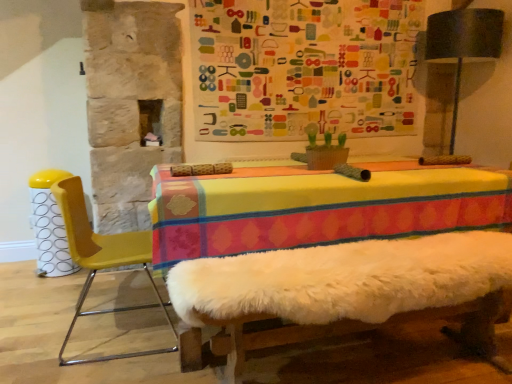
Question: Does yellow plastic chair at left have a greater height compared to yellow plastic bar stool at left?

Choices:
 (A) yes
 (B) no

Answer: (A)

Question: Is yellow plastic chair at left thinner than yellow plastic bar stool at left?

Choices:
 (A) no
 (B) yes

Answer: (A)

Question: Considering the relative sizes of yellow plastic chair at left and yellow plastic bar stool at left in the image provided, is yellow plastic chair at left smaller than yellow plastic bar stool at left?

Choices:
 (A) no
 (B) yes

Answer: (A)

Question: From a real-world perspective, is yellow plastic chair at left on yellow plastic bar stool at left?

Choices:
 (A) yes
 (B) no

Answer: (A)

Question: Is there a large distance between yellow plastic chair at left and yellow plastic bar stool at left?

Choices:
 (A) yes
 (B) no

Answer: (B)

Question: From a real-world perspective, is multicolored fabric bulletin board at upper center above or below yellow plastic bar stool at left?

Choices:
 (A) below
 (B) above

Answer: (B)

Question: Relative to yellow plastic bar stool at left, is multicolored fabric bulletin board at upper center in front or behind?

Choices:
 (A) behind
 (B) front

Answer: (A)

Question: Is multicolored fabric bulletin board at upper center inside the boundaries of yellow plastic bar stool at left, or outside?

Choices:
 (A) outside
 (B) inside

Answer: (A)

Question: Is multicolored fabric bulletin board at upper center taller or shorter than yellow plastic bar stool at left?

Choices:
 (A) tall
 (B) short

Answer: (A)

Question: Based on their sizes in the image, would you say white fluffy bed frame at center is bigger or smaller than multicolored fabric bulletin board at upper center?

Choices:
 (A) small
 (B) big

Answer: (B)

Question: From their relative heights in the image, would you say white fluffy bed frame at center is taller or shorter than multicolored fabric bulletin board at upper center?

Choices:
 (A) tall
 (B) short

Answer: (B)

Question: From a real-world perspective, is white fluffy bed frame at center positioned above or below multicolored fabric bulletin board at upper center?

Choices:
 (A) above
 (B) below

Answer: (B)

Question: Visually, is white fluffy bed frame at center positioned to the left or to the right of multicolored fabric bulletin board at upper center?

Choices:
 (A) right
 (B) left

Answer: (B)

Question: From a real-world perspective, is white fluffy bed frame at center positioned above or below yellow plastic chair at left?

Choices:
 (A) below
 (B) above

Answer: (A)

Question: Is point click(286, 253) positioned closer to the camera than point click(103, 238)?

Choices:
 (A) closer
 (B) farther

Answer: (A)